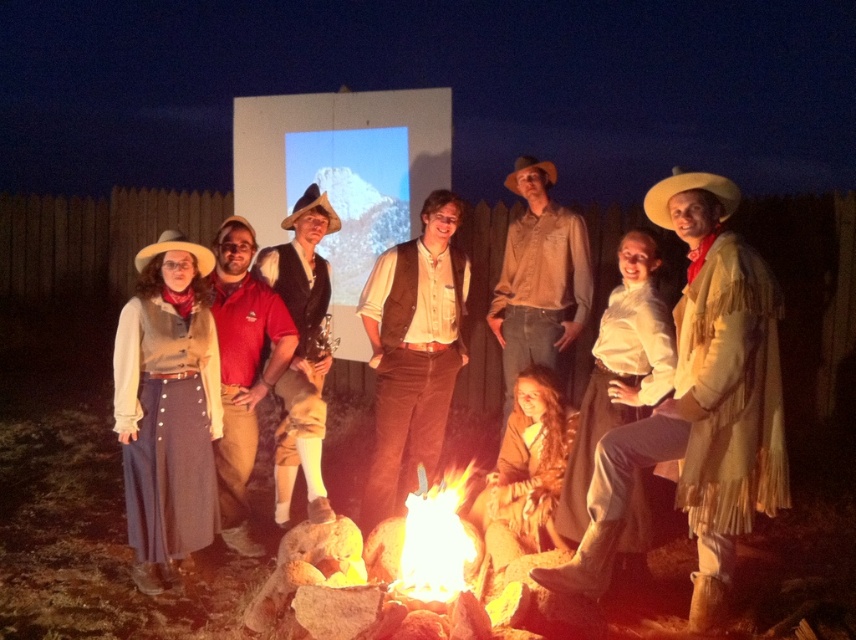
You are a photographer trying to capture a clear shot of the matte brown vest at center and the light brown felt cowboy hat at left. Since the vest is under the hat, will the hat block the view of the vest in your photo?

The matte brown vest at center is positioned under the light brown felt cowboy hat at left, so the hat may partially block the view of the vest depending on the angle and perspective of the photo.

You are a photographer at the campfire scene. You need to capture a closeup of the white cotton blouse at center and the light brown felt cowboy hat at left. Which object should you focus on first if you want to ensure both are in focus without moving the camera?

The white cotton blouse at center is larger in size than the light brown felt cowboy hat at left, so focusing on the larger object first would help ensure both are in focus.

You are standing in front of the campfire scene. There are two points marked in the image. The first point is at coordinates point (727, 262) and the second point is at point (421, 371). Which point is closer to you?

Point (727, 262) is closer to the viewer than point (421, 371).